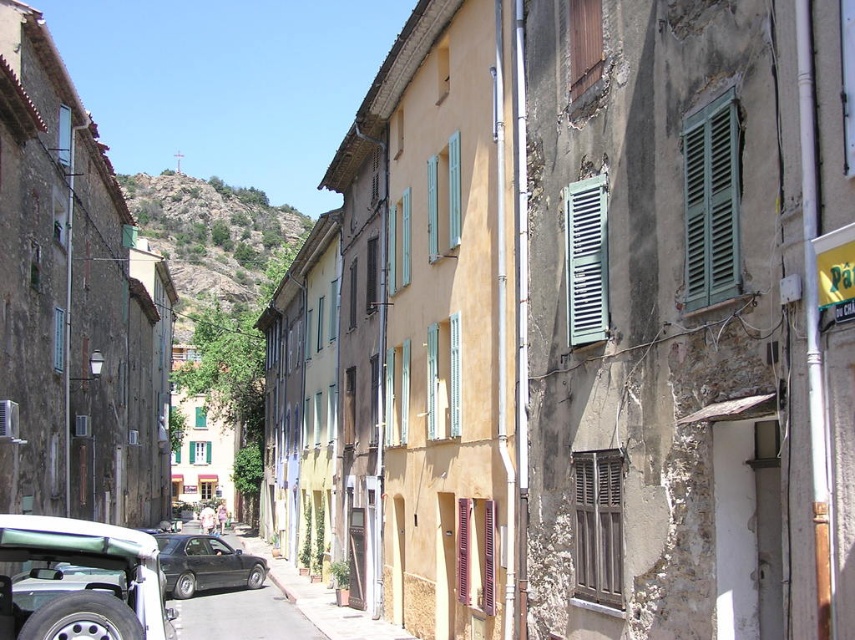
You are standing at the point marked by coordinates point [84,580] in the image. What object is located at that point?

The point [84,580] marks the silver metallic jeep at lower left.

You are a tourist standing on the street and want to take a photo of the green wooden shutters at upper right and the shiny black sedan at center. Which object should you focus on first to ensure both are in the frame?

You should focus on the green wooden shutters at upper right first because it is closer to you than the shiny black sedan at center, so adjusting the camera to include both would require starting with the closer object.

You are a delivery person trying to park your van in this street. The van is 20 feet long. There is a white car and a black car parked parallel to the curb. The distance between the green wooden shutters at upper right and the nearest parked car is 49.27 feet. Can you safely park your van between them without hitting the shutters or the cars?

The distance between the green wooden shutters at upper right and the nearest parked car is 49.27 feet. Since your van is only 20 feet long, there is sufficient space to park safely between them without any collisions.